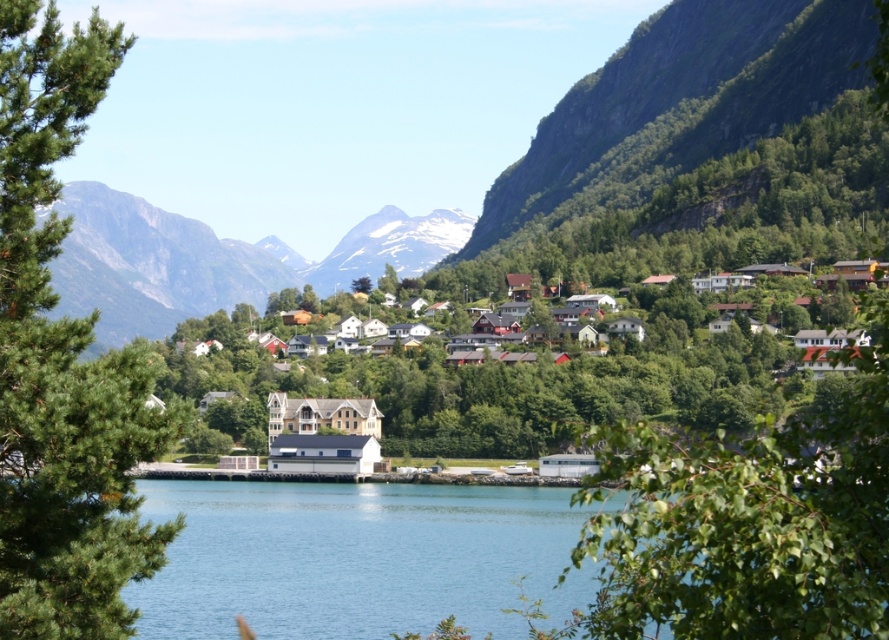
Question: Which object is closer to the camera taking this photo?

Choices:
 (A) green leafy tree at left
 (B) snowy rock mountain at center
 (C) green rocky mountain at upper left

Answer: (A)

Question: Which point appears closest to the camera in this image?

Choices:
 (A) (31, 566)
 (B) (151, 296)
 (C) (431, 241)
 (D) (519, 172)

Answer: (A)

Question: Is white wooden houses at center closer to the viewer compared to green rocky mountain at upper left?

Choices:
 (A) yes
 (B) no

Answer: (A)

Question: Can you confirm if white wooden houses at center is positioned below green rocky mountain at upper left?

Choices:
 (A) yes
 (B) no

Answer: (A)

Question: Can you confirm if green leafy tree at left is smaller than green rocky mountain at upper right?

Choices:
 (A) yes
 (B) no

Answer: (A)

Question: Which object is closer to the camera taking this photo?

Choices:
 (A) green rocky mountain at upper right
 (B) green leafy tree at left
 (C) green rocky mountain at upper left
 (D) snowy rock mountain at center

Answer: (B)